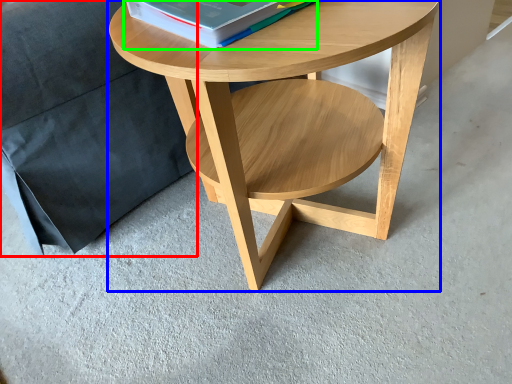
Question: Which object is positioned farthest from pillow (highlighted by a red box)? Select from coffee table (highlighted by a blue box) and paperback book (highlighted by a green box).

Choices:
 (A) coffee table
 (B) paperback book

Answer: (B)